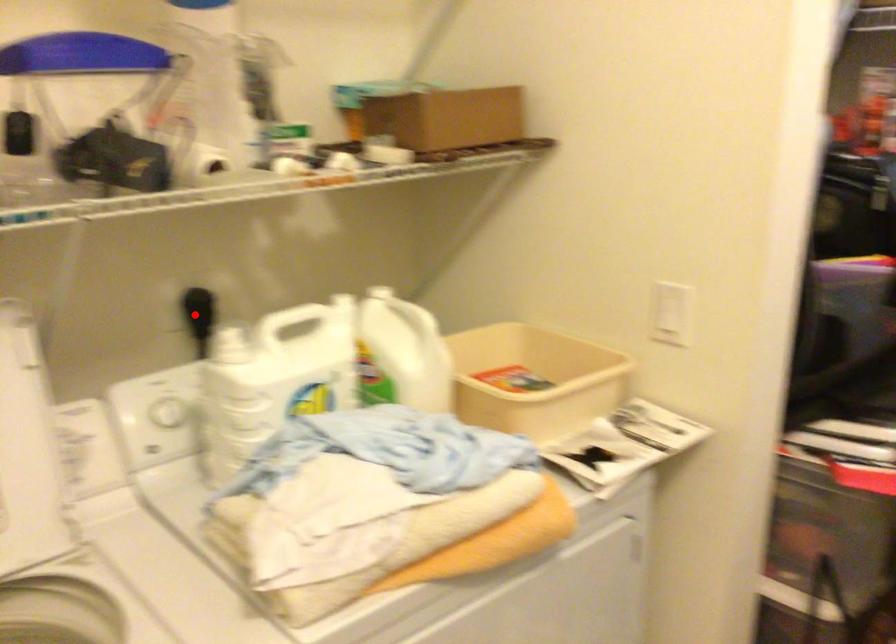
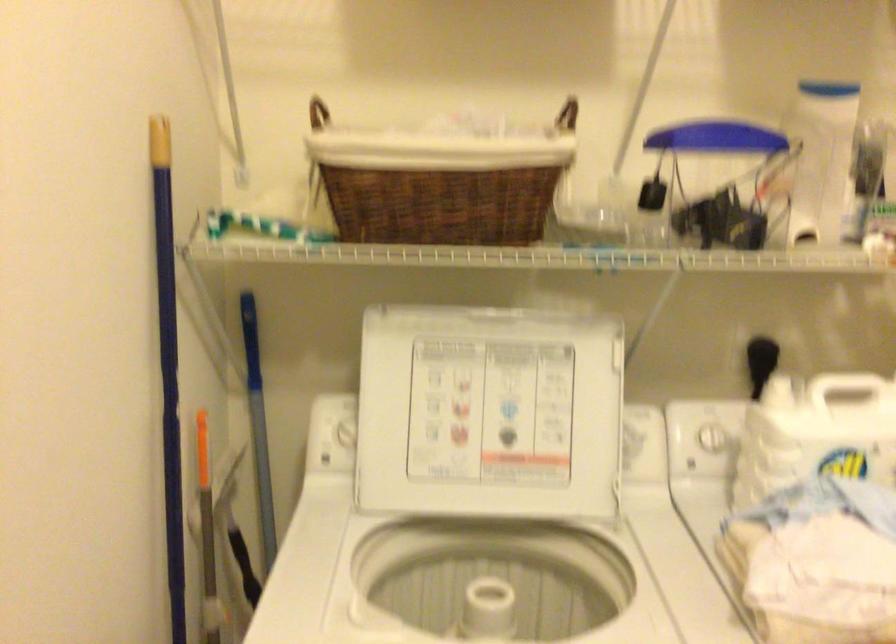
Find the pixel in the second image that matches the highlighted location in the first image.

(760, 362)